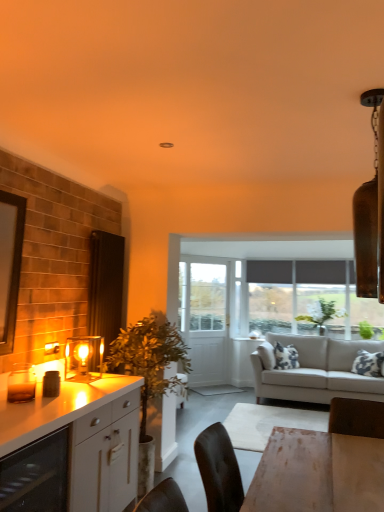
Question: Considering the relative positions of green leafy plant at upper center and matte glass wine cooler at lower left in the image provided, is green leafy plant at upper center to the left or to the right of matte glass wine cooler at lower left?

Choices:
 (A) left
 (B) right

Answer: (B)

Question: Considering the positions of green leafy plant at upper center and matte glass wine cooler at lower left in the image, is green leafy plant at upper center taller or shorter than matte glass wine cooler at lower left?

Choices:
 (A) short
 (B) tall

Answer: (B)

Question: Considering the real-world distances, which object is farthest from the green leafy plant at upper center?

Choices:
 (A) matte glass lampshade at left
 (B) matte glass wine cooler at lower left
 (C) white glossy cabinet at left
 (D) green leafy plant at left
 (E) light gray fabric couch at center

Answer: (B)

Question: Which object is positioned closest to the green leafy plant at upper center?

Choices:
 (A) green leafy plant at left
 (B) white glossy cabinet at left
 (C) matte glass lampshade at left
 (D) light gray fabric couch at center
 (E) matte glass wine cooler at lower left

Answer: (D)